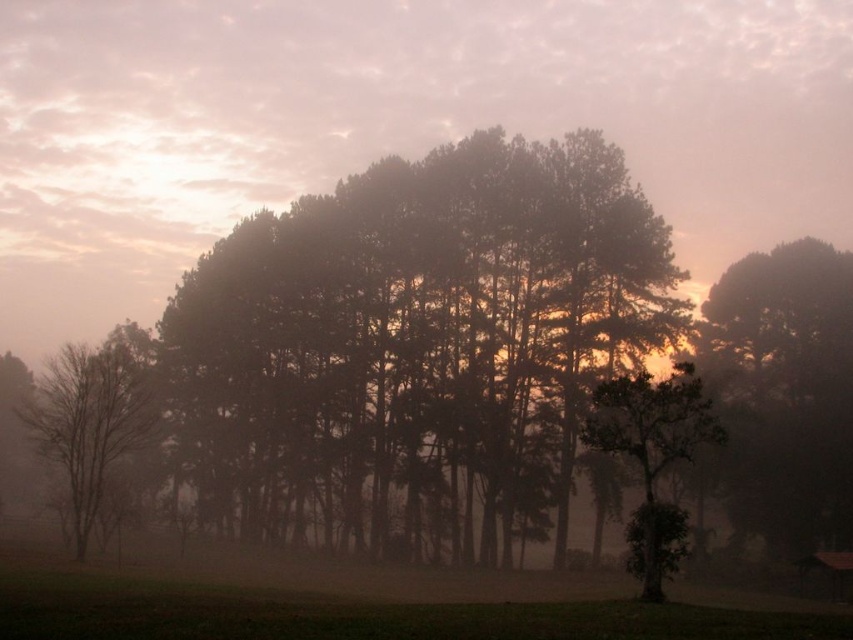
You are standing at the edge of the grassy area in the foreground of the image. You want to walk towards the dark green foliage at center. Which direction should you head?

The dark green foliage at center is located at point (418, 342), so you should head towards the center of the image to reach it.

You are an artist setting up your easel in the misty landscape scene. You want to paint the dark green textured tree at right and the bare wood tree at left. Based on their positions, which tree should you focus on first to capture their depth relationship accurately?

You should focus on the dark green textured tree at right first because it is closer to you than the bare wood tree at left, so it appears in front of it in the scene.